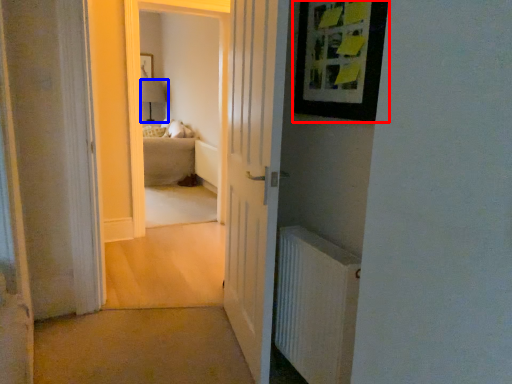
Question: Which object appears closest to the camera in this image, picture frame (highlighted by a red box) or lamp (highlighted by a blue box)?

Choices:
 (A) picture frame
 (B) lamp

Answer: (A)